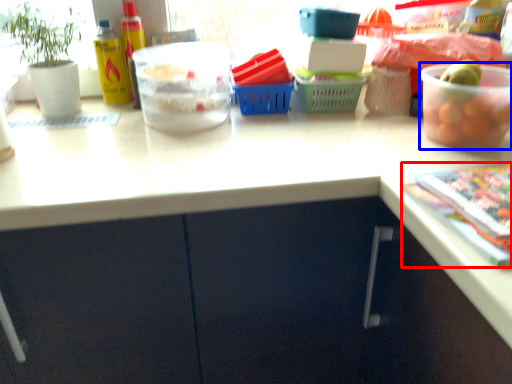
Question: Which of the following is the farthest to the observer, magazine (highlighted by a red box) or bowl (highlighted by a blue box)?

Choices:
 (A) magazine
 (B) bowl

Answer: (B)